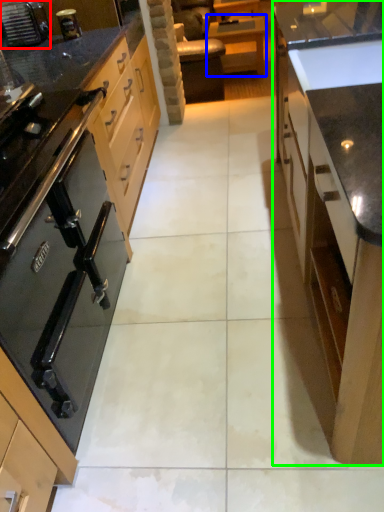
Question: Which is nearer to the home appliance (highlighted by a red box)? table (highlighted by a blue box) or cabinetry (highlighted by a green box).

Choices:
 (A) table
 (B) cabinetry

Answer: (B)